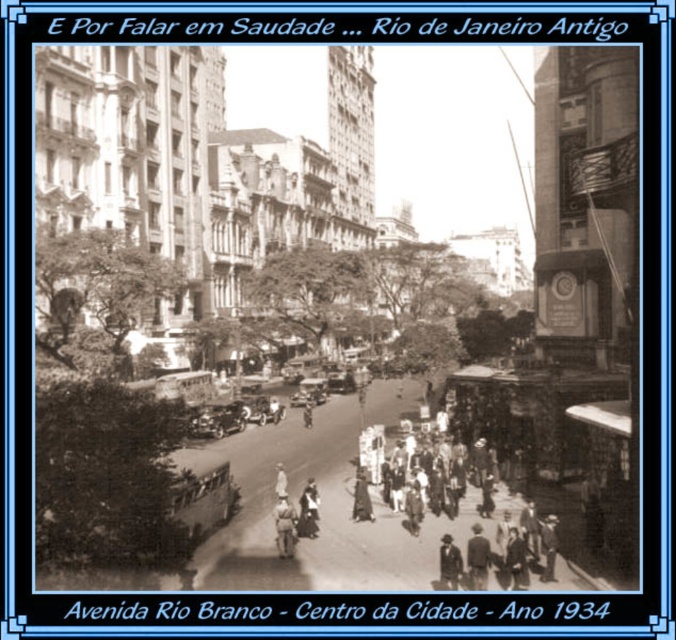
Does light brown leather hat at lower center appear over dark gray fabric coat at center?

No, light brown leather hat at lower center is not above dark gray fabric coat at center.

Find the location of a particular element. The image size is (676, 640). light brown leather hat at lower center is located at coordinates (477, 557).

Is light brown leather jacket at center positioned at the back of dark gray fabric coat at center?

No, light brown leather jacket at center is in front of dark gray fabric coat at center.

Where is `light brown leather jacket at center`? The height and width of the screenshot is (640, 676). light brown leather jacket at center is located at coordinates (285, 528).

You are a GUI agent. You are given a task and a screenshot of the screen. Output one action in this format:
    pyautogui.click(x=<x>, y=<y>)
    Task: Click on the light brown leather jacket at center
    Image resolution: width=676 pixels, height=640 pixels.
    Given the screenshot: What is the action you would take?
    pyautogui.click(x=285, y=528)

Is light brown leather hat at lower center further to camera compared to light brown leather coat at center?

No, it is not.

Does light brown leather hat at lower center have a lesser width compared to light brown leather coat at center?

Yes.

Between point (477, 548) and point (356, 509), which one is positioned in front?

Positioned in front is point (477, 548).

Where is `light brown leather hat at lower center`? Image resolution: width=676 pixels, height=640 pixels. light brown leather hat at lower center is located at coordinates (477, 557).